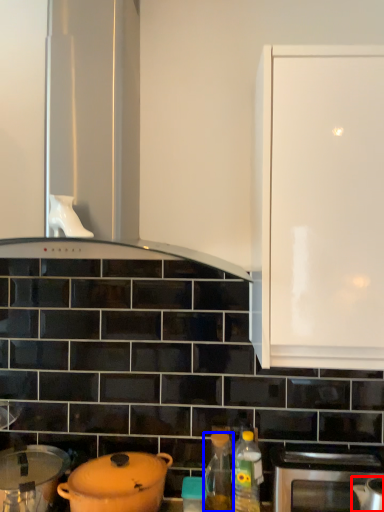
Question: Which of the following is the closest to the observer, kitchen appliance (highlighted by a red box) or bottle (highlighted by a blue box)?

Choices:
 (A) kitchen appliance
 (B) bottle

Answer: (A)